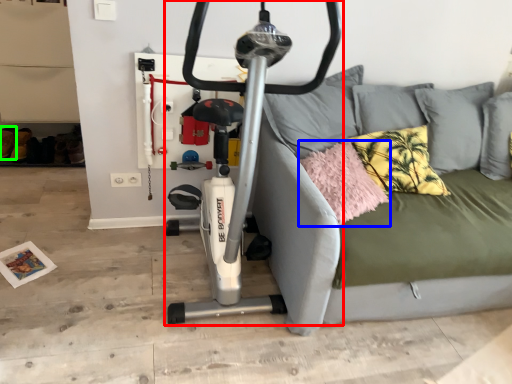
Question: Which is nearer to the stationary bicycle (highlighted by a red box)? pillow (highlighted by a blue box) or shoe (highlighted by a green box).

Choices:
 (A) pillow
 (B) shoe

Answer: (A)